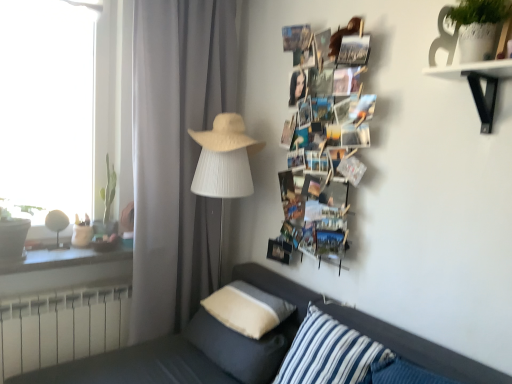
Question: From a real-world perspective, is beige woven fedora at center located higher than white metallic radiator at lower left?

Choices:
 (A) yes
 (B) no

Answer: (A)

Question: Are beige woven fedora at center and white metallic radiator at lower left making contact?

Choices:
 (A) no
 (B) yes

Answer: (A)

Question: Is white metallic radiator at lower left at the back of beige woven fedora at center?

Choices:
 (A) yes
 (B) no

Answer: (B)

Question: Is the position of beige woven fedora at center more distant than that of white metallic radiator at lower left?

Choices:
 (A) no
 (B) yes

Answer: (B)

Question: From the image's perspective, is beige woven fedora at center above white metallic radiator at lower left?

Choices:
 (A) no
 (B) yes

Answer: (B)

Question: Is beige woven fedora at center at the right side of white metallic radiator at lower left?

Choices:
 (A) yes
 (B) no

Answer: (A)

Question: Is white metallic radiator at lower left in front of matte wood window sill at left?

Choices:
 (A) yes
 (B) no

Answer: (B)

Question: Is white metallic radiator at lower left further to camera compared to matte wood window sill at left?

Choices:
 (A) no
 (B) yes

Answer: (B)

Question: Can you see white metallic radiator at lower left touching matte wood window sill at left?

Choices:
 (A) no
 (B) yes

Answer: (A)

Question: Is white metallic radiator at lower left bigger than matte wood window sill at left?

Choices:
 (A) no
 (B) yes

Answer: (B)

Question: Can you confirm if white metallic radiator at lower left is shorter than matte wood window sill at left?

Choices:
 (A) no
 (B) yes

Answer: (A)

Question: Is matte wood window sill at left completely or partially inside white metallic radiator at lower left?

Choices:
 (A) no
 (B) yes

Answer: (A)

Question: Considering the relative sizes of soft beige pillow at lower center, positioned as the 2th pillow in front-to-back order, and matte white table lamp at left, which is the 2th table lamp in right-to-left order, in the image provided, is soft beige pillow at lower center, positioned as the 2th pillow in front-to-back order, shorter than matte white table lamp at left, which is the 2th table lamp in right-to-left order,?

Choices:
 (A) yes
 (B) no

Answer: (A)